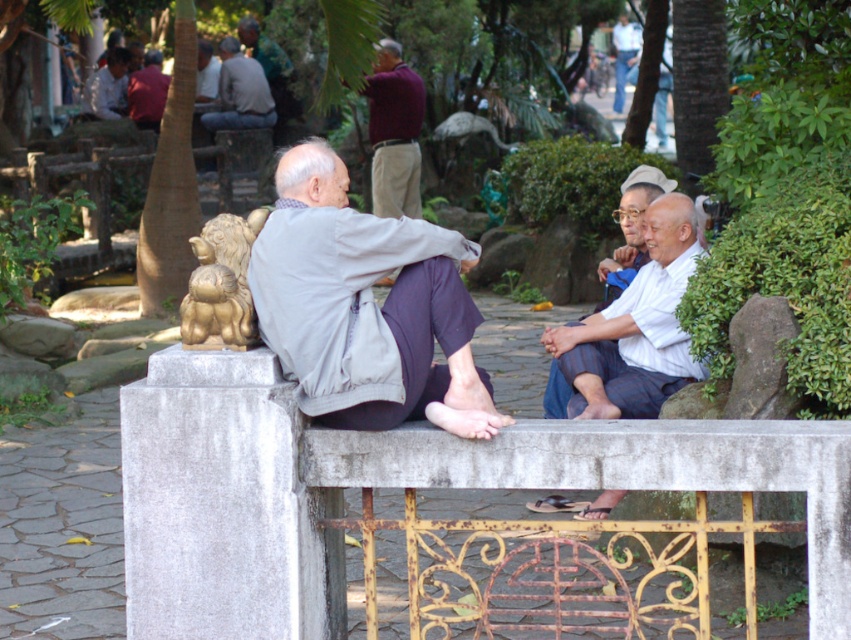
Question: Does gray concrete at left come behind rusty metal bench at center?

Choices:
 (A) no
 (B) yes

Answer: (B)

Question: Can you confirm if gray concrete at left is smaller than gray cotton shirt at center?

Choices:
 (A) yes
 (B) no

Answer: (B)

Question: Which object is the closest to the gray concrete at left?

Choices:
 (A) matte red shirt at upper left
 (B) gray wool sweater at upper left

Answer: (B)

Question: Is gray concrete at left to the left of maroon sweater at center from the viewer's perspective?

Choices:
 (A) yes
 (B) no

Answer: (A)

Question: Estimate the real-world distances between objects in this image. Which object is farther from the maroon sweater at center?

Choices:
 (A) light blue jeans at upper center
 (B) rusty metal bench at center
 (C) white striped pants at center
 (D) matte gray shirt at upper left

Answer: (B)

Question: Among these objects, which one is farthest from the camera?

Choices:
 (A) matte gray shirt at center
 (B) rusty metal bench at center
 (C) white striped fabric at right

Answer: (A)